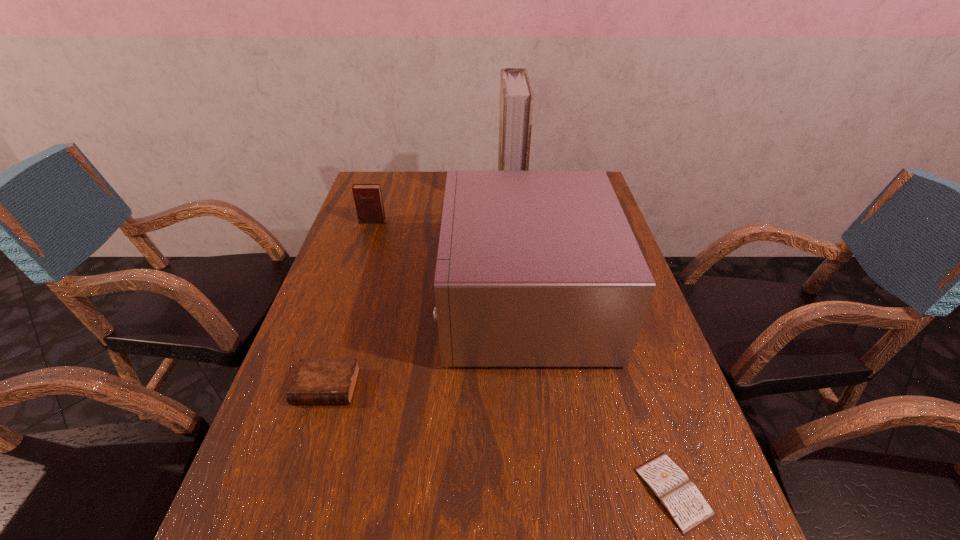
Locate an element on the screen. blank area in the image that satisfies the following two spatial constraints: 1. on the spine side of the fourth tallest object; 2. on the left side of the nearest object is located at coordinates (294, 491).

Image resolution: width=960 pixels, height=540 pixels. I want to click on free spot that satisfies the following two spatial constraints: 1. on the spine side of the rightmost diary; 2. on the right side of the second shortest diary, so click(294, 491).

I want to click on blank area in the image that satisfies the following two spatial constraints: 1. on the spine side of the second farthest diary; 2. on the left side of the rightmost diary, so click(294, 491).

At what (x,y) coordinates should I click in order to perform the action: click on vacant space that satisfies the following two spatial constraints: 1. with the door open on the second tallest object; 2. on the spine side of the fourth tallest object. Please return your answer as a coordinate pair (x, y). The width and height of the screenshot is (960, 540). Looking at the image, I should click on (534, 387).